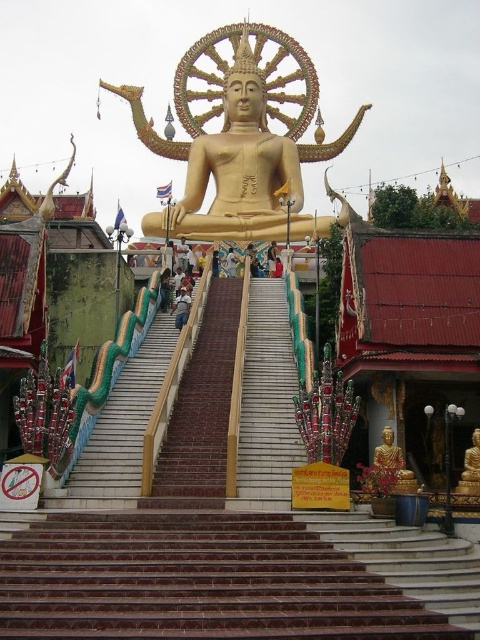
You are standing at the entrance of the temple complex and want to reach the large golden Buddha statue at its center. According to the image, where is the point at coordinates (228, 538) located?

The point at coordinates (228, 538) is located on the white marble stairs at center, which lead up to the large golden Buddha statue at its center.

You are a visitor standing at the entrance of the temple complex and want to reach the gold polished statue at center. The white marble stairs at center are in your path. Given that the stairs are 52.45 meters away from the statue, can you walk directly to the statue without climbing the stairs?

The distance between the white marble stairs at center and the gold polished statue at center is 52.45 meters. Since the stairs are part of the path leading up to the statue, you would need to climb them to reach the statue directly.

You are a visitor standing at the entrance of the temple complex. You want to take a photo of the gold polished statue at center without the white marble stairs at center appearing in the frame. Is this possible given their relative sizes?

The white marble stairs at center is not as tall as gold polished statue at center, so it is possible to take a photo of the gold polished statue at center without including the white marble stairs at center by adjusting the camera angle to focus solely on the taller statue.